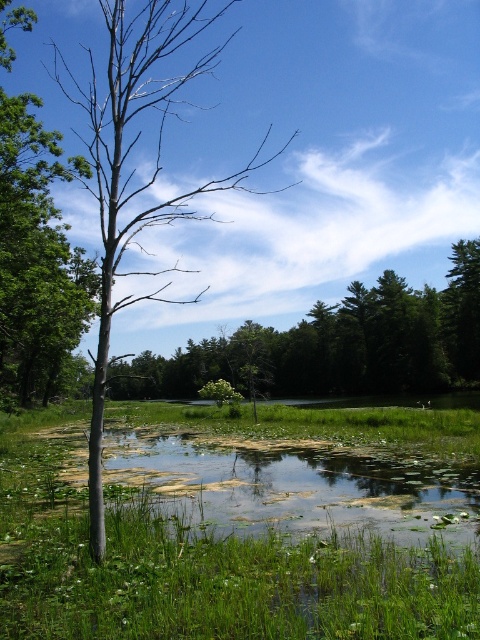
You are a bird looking for a nesting spot. You see the smooth bark tree at center and the smooth gray tree at left. Which tree is shorter and better for nesting?

The smooth bark tree at center is shorter than the smooth gray tree at left, making it a better option for nesting if you prefer a lower height.